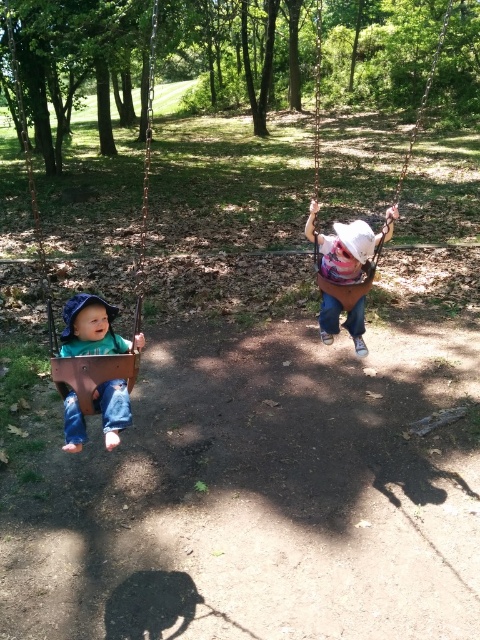
You are standing at the point labeled point (13, 61) and want to walk to the point labeled point (315, 109). Which direction should you face to walk directly towards your destination?

To walk directly from point (13, 61) to point (315, 109), you should face northeast because point (13, 61) is in front of point (315, 109), indicating the destination is northeast of your current position.

Based on the photo, you are standing in the park and want to reach the rusty metal swing at left. The park has a rule that you must stay at least 10 feet away from any swing to avoid disrupting others. Are you currently within the allowed distance?

The rusty metal swing at left is 7.89 feet from viewer, so you are currently within the allowed distance since you are closer than the required 10 feet.